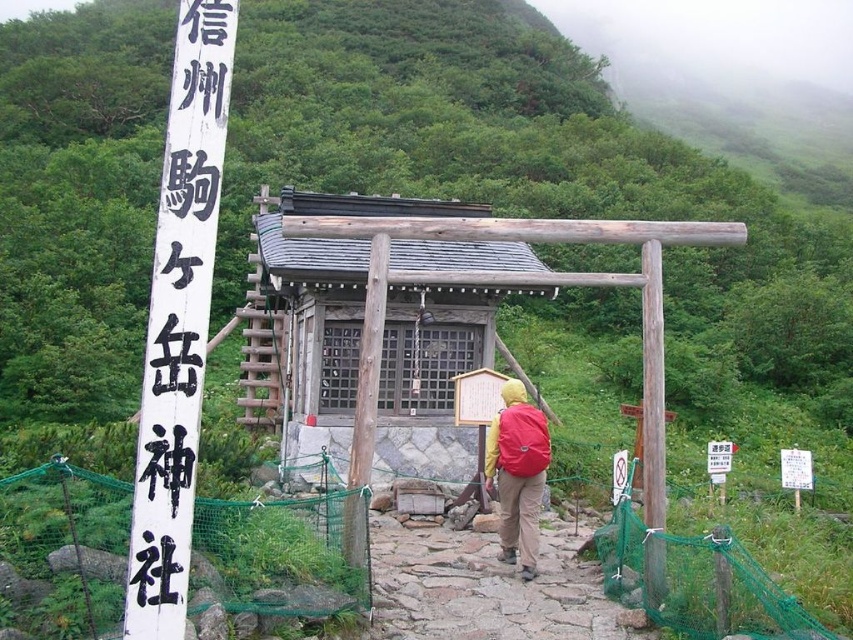
You are a visitor at the shrine and want to take a photo of the wooden shrine at center and the brown stone path at center. Which object should you focus on first if you want to capture both in a single frame without zooming in or out?

The wooden shrine at center is larger in size than the brown stone path at center, so you should focus on the wooden shrine at center first to ensure it fits properly in the frame before adjusting for the smaller brown stone path at center.

You are a visitor at a traditional Japanese shrine and want to find the main entrance. You see the wooden shrine at center and the brown stone path at center. Which one is higher in elevation?

The wooden shrine at center is above the brown stone path at center, so the wooden shrine at center is higher in elevation.

You are a visitor at the shrine and want to place a small offering on the wooden shrine at center. However, you notice the brown wooden pole at center is in the way. Can you place the offering on the shrine without moving the pole?

The wooden shrine at center is positioned over the brown wooden pole at center, so you can place the offering on the shrine without moving the pole since the shrine is above the pole.